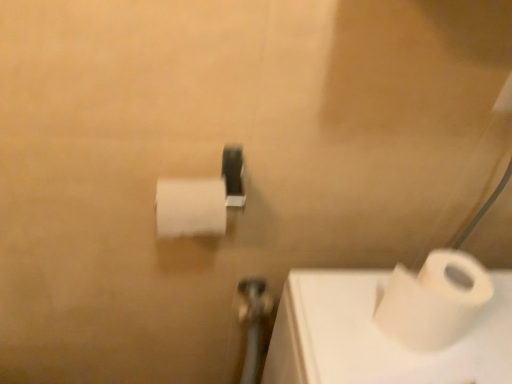
Question: Does white matte toilet paper at lower right, which is the 1th toilet paper from right to left, turn towards white matte toilet paper at center, the 1th toilet paper in the left-to-right sequence?

Choices:
 (A) no
 (B) yes

Answer: (A)

Question: Can you confirm if white matte toilet paper at lower right, the 1th toilet paper from the bottom, is bigger than white matte toilet paper at center, positioned as the 2th toilet paper in right-to-left order?

Choices:
 (A) yes
 (B) no

Answer: (A)

Question: From the image's perspective, is white matte toilet paper at lower right, marked as the second toilet paper in a left-to-right arrangement, on white matte toilet paper at center, positioned as the 2th toilet paper in bottom-to-top order?

Choices:
 (A) yes
 (B) no

Answer: (B)

Question: Are white matte toilet paper at lower right, acting as the second toilet paper starting from the top, and white matte toilet paper at center, positioned as the 2th toilet paper in bottom-to-top order, making contact?

Choices:
 (A) yes
 (B) no

Answer: (B)

Question: Is white matte toilet paper at lower right, acting as the second toilet paper starting from the top, facing away from white matte toilet paper at center, positioned as the 2th toilet paper in bottom-to-top order?

Choices:
 (A) no
 (B) yes

Answer: (A)

Question: From a real-world perspective, is white matte toilet paper at lower right, the 1th toilet paper from the bottom, physically below white matte toilet paper at center, positioned as the 2th toilet paper in right-to-left order?

Choices:
 (A) no
 (B) yes

Answer: (B)

Question: Is metallic silver shower at center wider than white matte toilet paper at center, positioned as the 2th toilet paper in right-to-left order?

Choices:
 (A) yes
 (B) no

Answer: (A)

Question: Is metallic silver shower at center at the left side of white matte toilet paper at center, the 1th toilet paper in the left-to-right sequence?

Choices:
 (A) no
 (B) yes

Answer: (A)

Question: From a real-world perspective, is metallic silver shower at center over white matte toilet paper at center, positioned as the 2th toilet paper in right-to-left order?

Choices:
 (A) no
 (B) yes

Answer: (A)

Question: Are metallic silver shower at center and white matte toilet paper at center, positioned as the 2th toilet paper in right-to-left order, located far from each other?

Choices:
 (A) yes
 (B) no

Answer: (B)

Question: Can you confirm if metallic silver shower at center is taller than white matte toilet paper at center, which is the 1th toilet paper from top to bottom?

Choices:
 (A) no
 (B) yes

Answer: (B)

Question: Is metallic silver shower at center facing towards white matte toilet paper at center, which is the 1th toilet paper from top to bottom?

Choices:
 (A) no
 (B) yes

Answer: (A)

Question: Is white matte toilet paper at center, positioned as the 2th toilet paper in right-to-left order, wider than metallic silver shower at center?

Choices:
 (A) yes
 (B) no

Answer: (B)